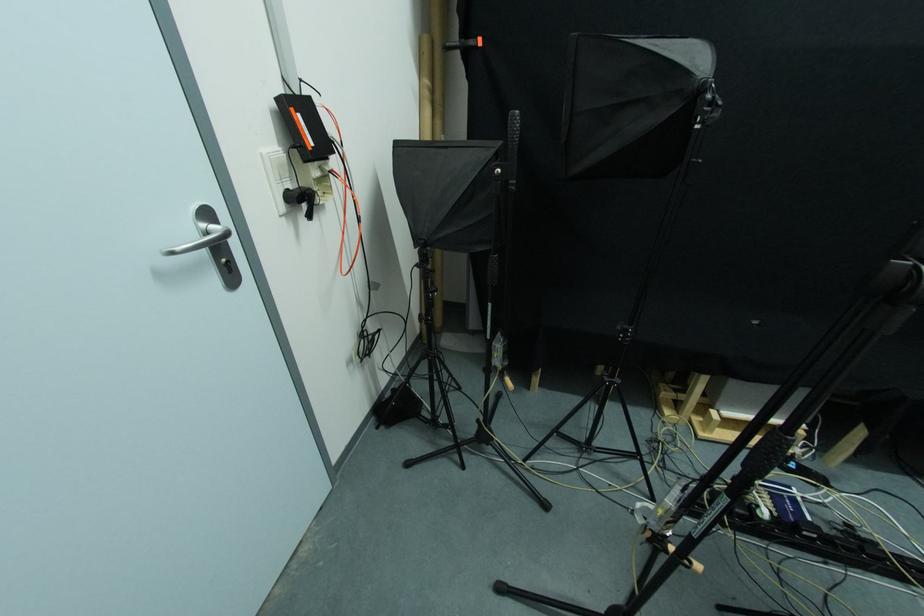
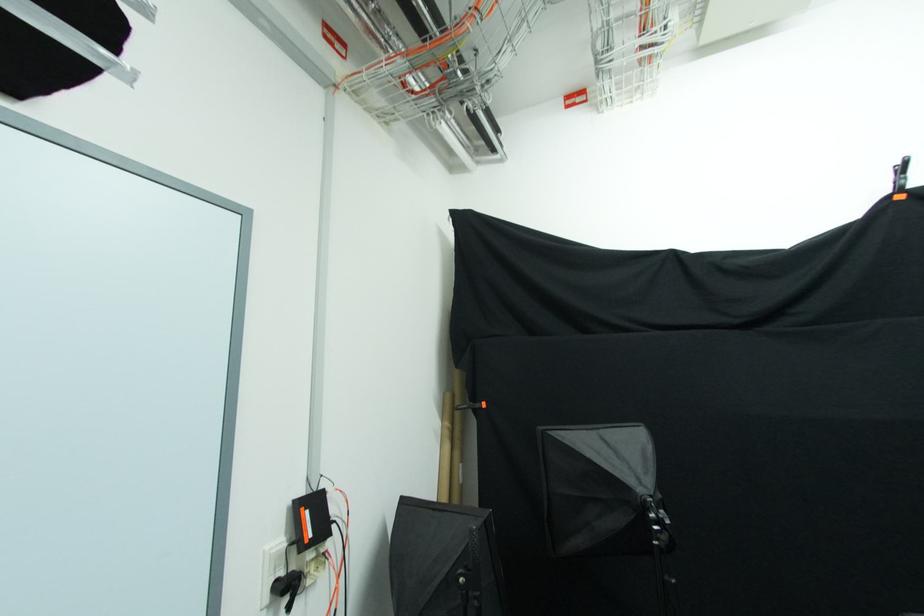
Where in the second image is the point corresponding to the point at 292,188 from the first image?

(285, 577)